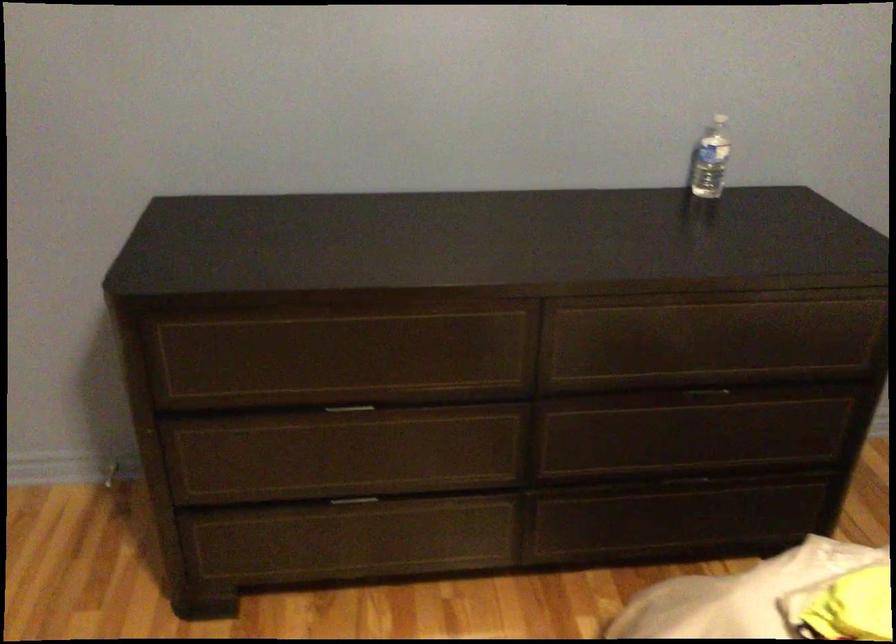
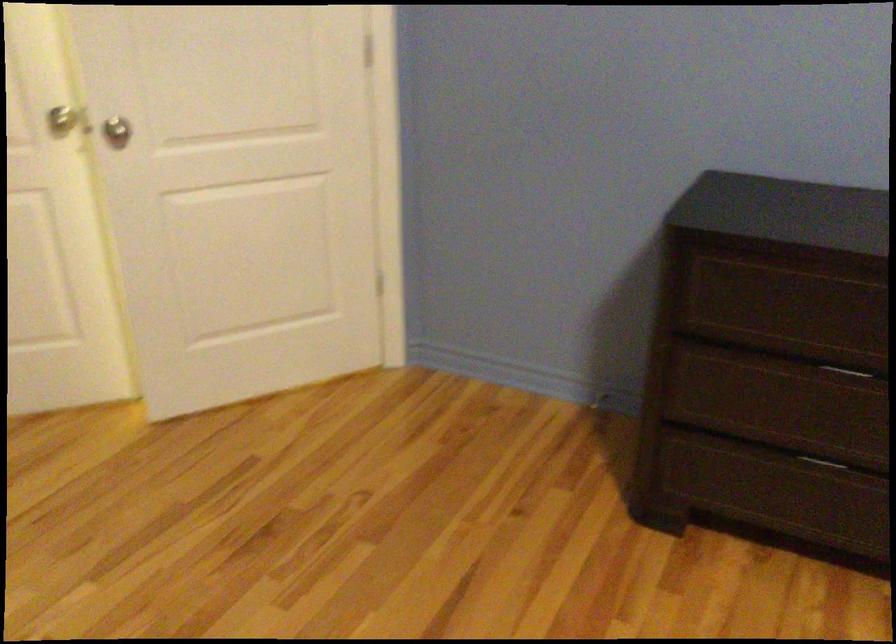
Question: Based on the continuous images, in which direction is the camera rotating? Reply with the corresponding letter.

Choices:
 (A) Left
 (B) Right
 (C) Up
 (D) Down

Answer: (A)